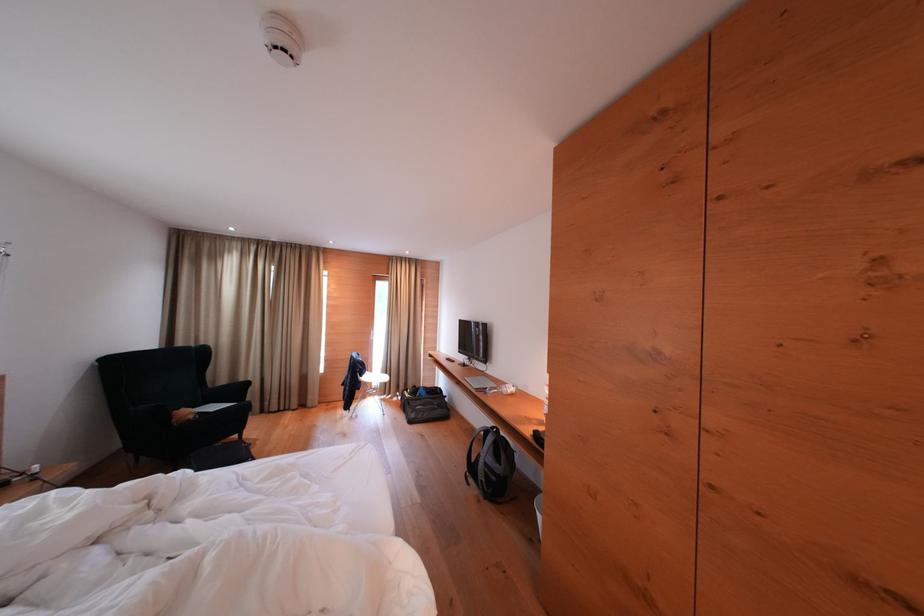
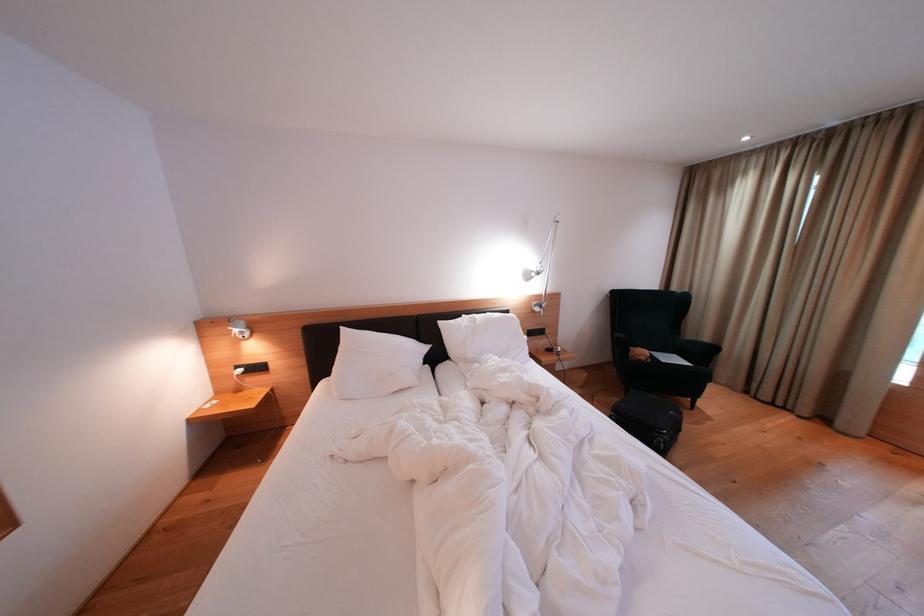
Question: The camera is either moving clockwise (left) or counter-clockwise (right) around the object. The first image is from the beginning of the video and the second image is from the end. Is the camera moving left or right when shooting the video?

Choices:
 (A) Left
 (B) Right

Answer: (B)